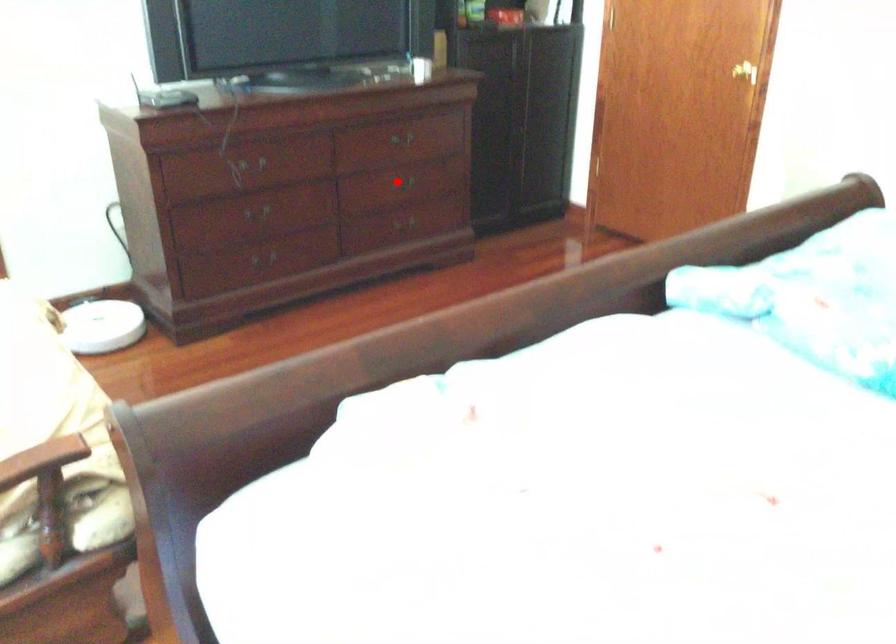
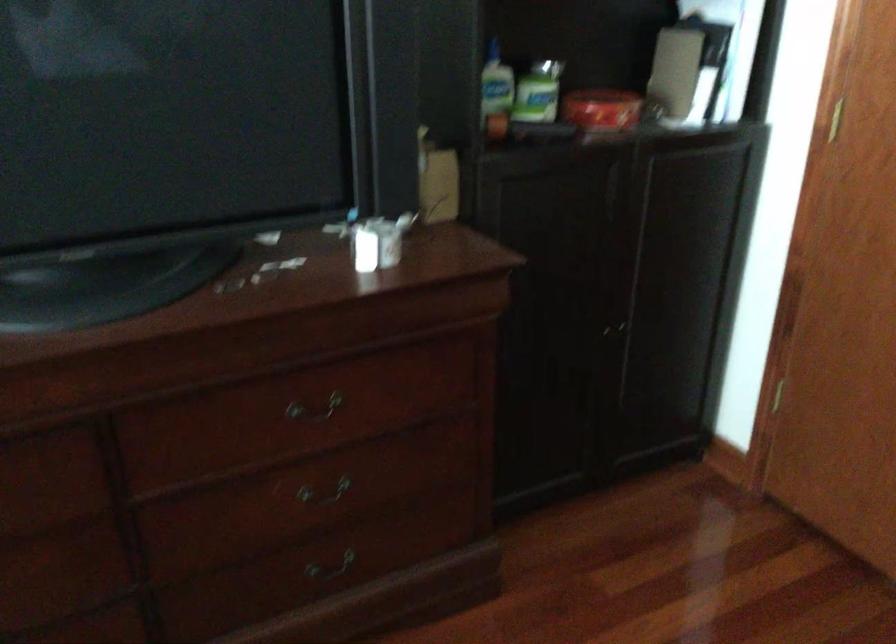
Question: I am providing you with two images of the same scene from different viewpoints. In image1, a red point is highlighted. Considering the same 3D point in image2, which of the following is correct?

Choices:
 (A) It is closer
 (B) It is farther

Answer: (A)